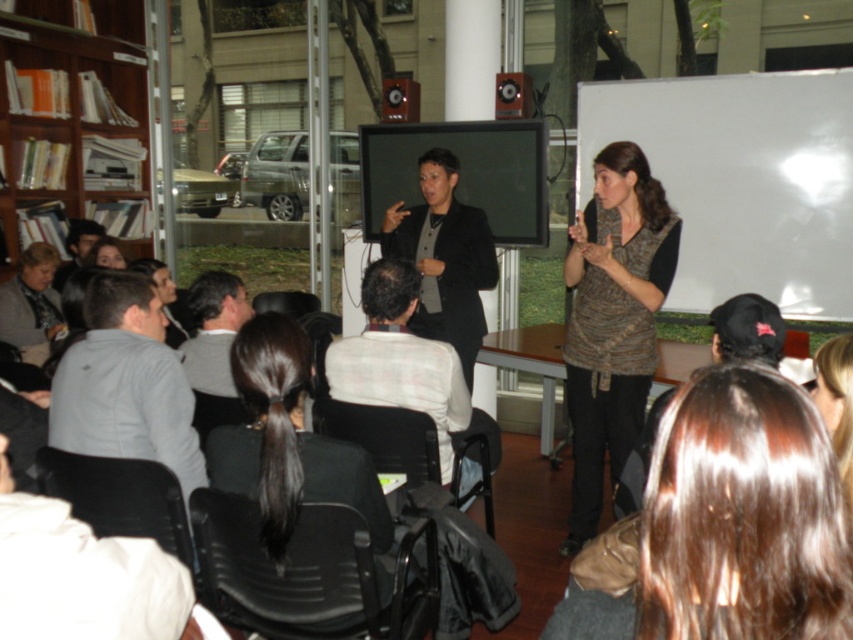
Question: Does knitted brown sweater at center have a smaller size compared to gray fabric shirt at left?

Choices:
 (A) no
 (B) yes

Answer: (A)

Question: Is white checkered shirt at center bigger than gray sweater at center?

Choices:
 (A) no
 (B) yes

Answer: (B)

Question: Is matte black jacket at center to the right of gray sweater at center from the viewer's perspective?

Choices:
 (A) no
 (B) yes

Answer: (B)

Question: Which of the following is the closest to the observer?

Choices:
 (A) knitted brown sweater at center
 (B) matte black hair at upper left
 (C) black hair at center
 (D) matte black screen at center

Answer: (C)

Question: Considering the real-world distances, which object is farthest from the matte black screen at center?

Choices:
 (A) matte black jacket at center
 (B) gray sweater at center
 (C) white checkered shirt at center
 (D) light gray sweater at lower left

Answer: (D)

Question: Which point is closer to the camera?

Choices:
 (A) matte black hair at upper left
 (B) matte black jacket at center
 (C) light gray sweater at lower left
 (D) black hair at center

Answer: (D)